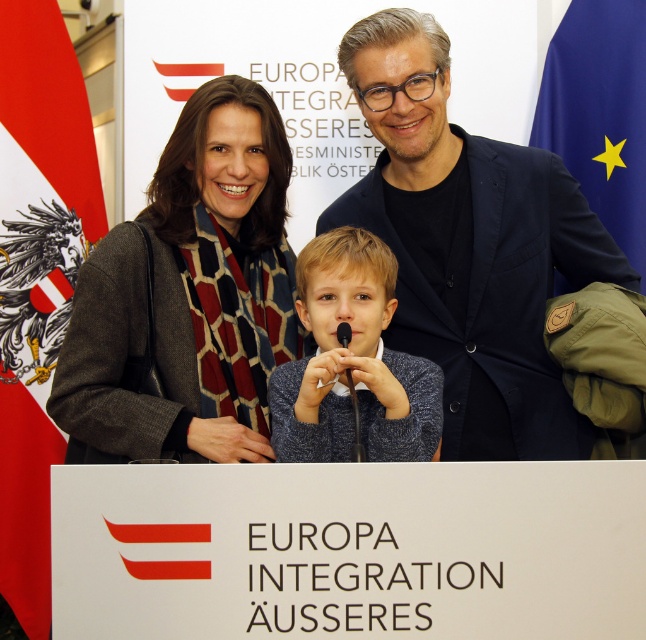
You are a photographer at the event and want to take a photo of the dark gray wool coat at center and the black matte microphone at center. Which object will appear larger in the photo?

The dark gray wool coat at center will appear larger in the photo because it is closer to the viewer than the black matte microphone at center.

What is the location of the point with coordinates (x=185, y=291) in the image?

The point with coordinates (x=185, y=291) is located on the dark gray wool coat at center.

You are attending a press conference and notice two items on the podium. The dark gray wool coat at center and the black matte microphone at center. Which item is positioned to the left of the other?

The dark gray wool coat at center is to the left of the black matte microphone at center.